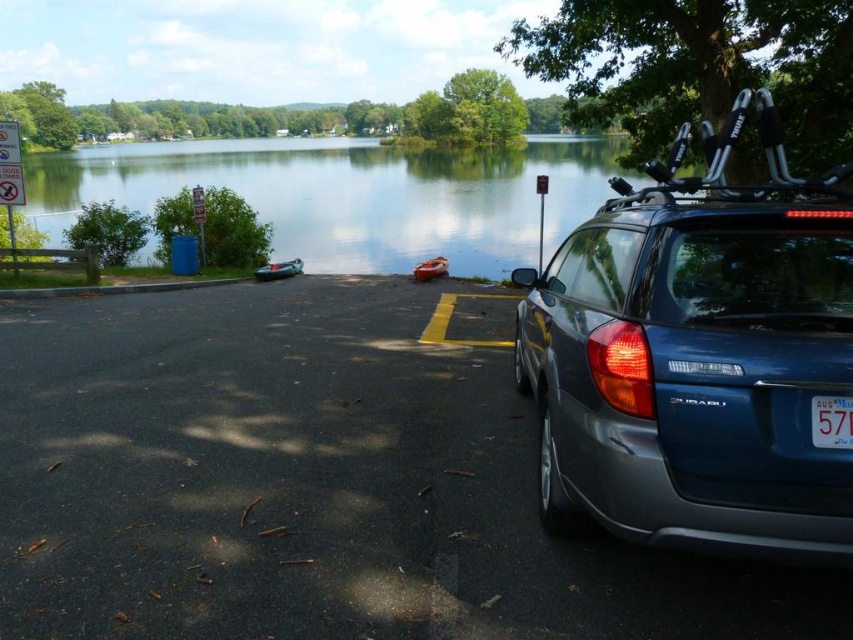
Can you confirm if metallic blue car at right is thinner than clear water at lake center?

Yes, metallic blue car at right is thinner than clear water at lake center.

Locate an element on the screen. metallic blue car at right is located at coordinates (693, 372).

Between point (578, 304) and point (53, 164), which one is positioned behind?

The point (53, 164) is more distant.

This screenshot has width=853, height=640. In order to click on metallic blue car at right in this screenshot , I will do `click(693, 372)`.

Does point (236, 476) come closer to viewer compared to point (505, 208)?

Yes, point (236, 476) is closer to viewer.

Does dark gray asphalt at lower right appear on the right side of clear water at lake center?

Correct, you'll find dark gray asphalt at lower right to the right of clear water at lake center.

The image size is (853, 640). I want to click on dark gray asphalt at lower right, so click(314, 484).

Is metallic blue car at right to the left of blue plastic license plate at lower right from the viewer's perspective?

Indeed, metallic blue car at right is positioned on the left side of blue plastic license plate at lower right.

Which is behind, point (776, 422) or point (821, 401)?

The point (776, 422) is more distant.

Is point (724, 394) positioned behind point (817, 404)?

Yes.

Where is `metallic blue car at right`? metallic blue car at right is located at coordinates (693, 372).